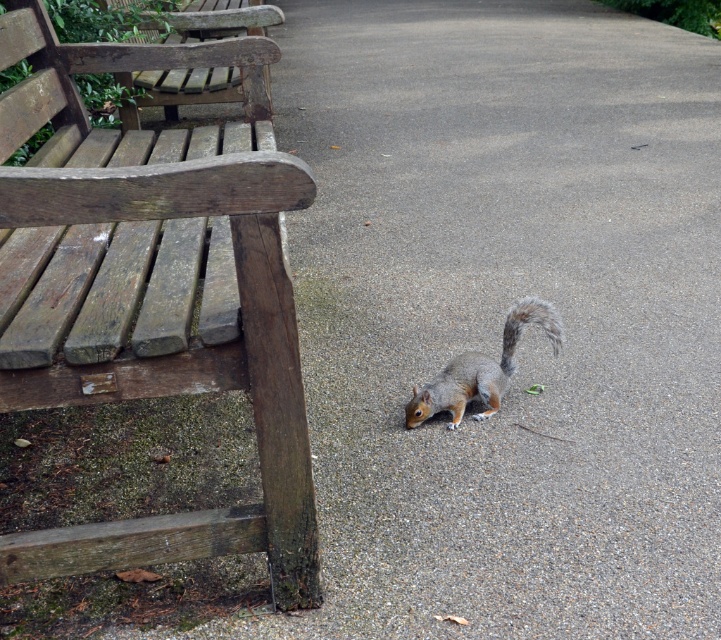
Is weathered wood bench at left shorter than gray-furred squirrel at lower center?

In fact, weathered wood bench at left may be taller than gray-furred squirrel at lower center.

Can you confirm if weathered wood bench at left is smaller than gray-furred squirrel at lower center?

No, weathered wood bench at left is not smaller than gray-furred squirrel at lower center.

Identify the location of weathered wood bench at left. click(145, 298).

Can you confirm if gray-furred squirrel at lower center is shorter than fuzzy gray tail at lower right?

No.

Is gray-furred squirrel at lower center thinner than fuzzy gray tail at lower right?

In fact, gray-furred squirrel at lower center might be wider than fuzzy gray tail at lower right.

Who is more forward, (x=517, y=314) or (x=526, y=316)?

Positioned in front is point (x=526, y=316).

Locate an element on the screen. The image size is (721, 640). gray-furred squirrel at lower center is located at coordinates (482, 369).

Measure the distance between weathered wood bench at left and fuzzy gray tail at lower right.

They are 4.08 feet apart.

Who is shorter, weathered wood bench at left or fuzzy gray tail at lower right?

fuzzy gray tail at lower right

Is point (37, 276) in front of point (528, 300)?

Yes.

Find the location of a particular element. weathered wood bench at left is located at coordinates (145, 298).